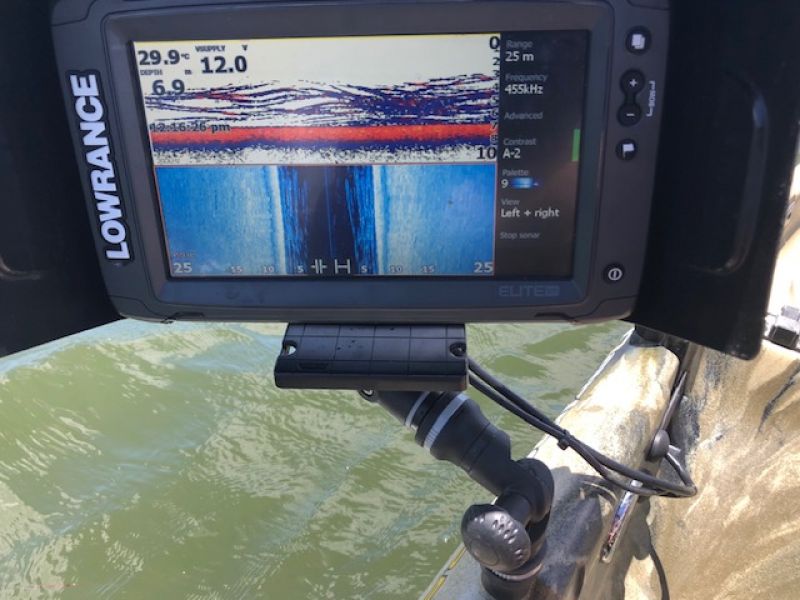
At what (x,y) coordinates should I click in order to perform the action: click on knob. Please return your answer as a coordinate pair (x, y). Looking at the image, I should click on (498, 541).